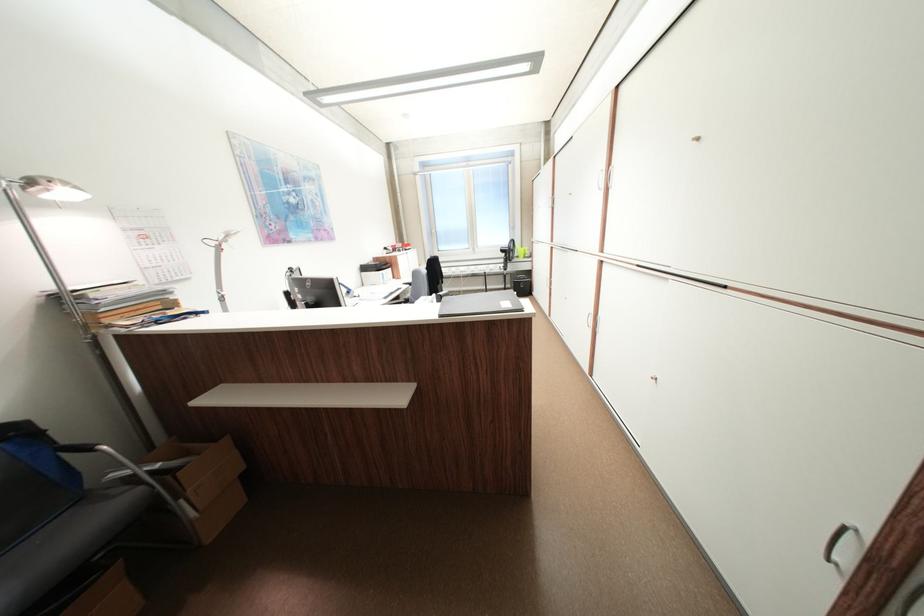
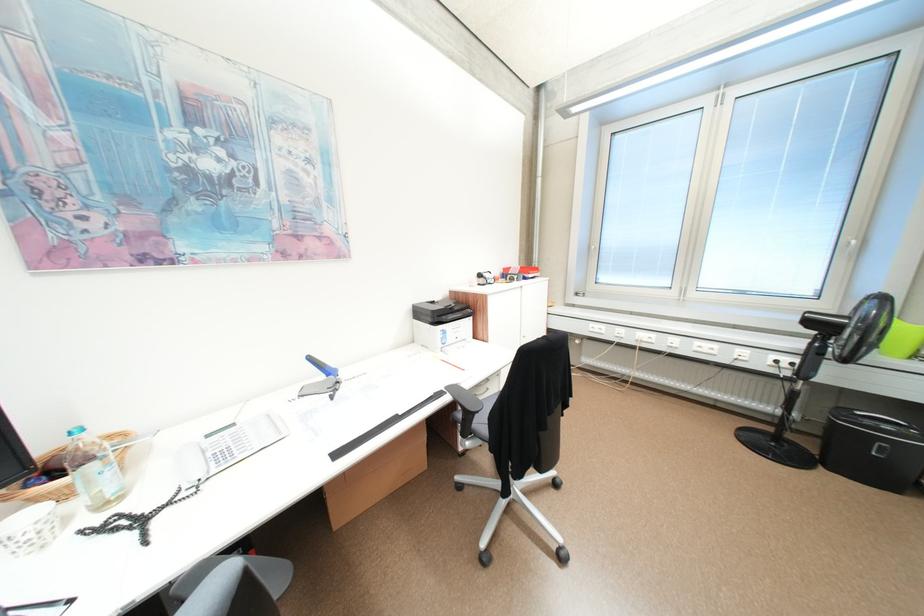
Where in the second image is the point corresponding to point (373, 269) from the first image?

(428, 313)